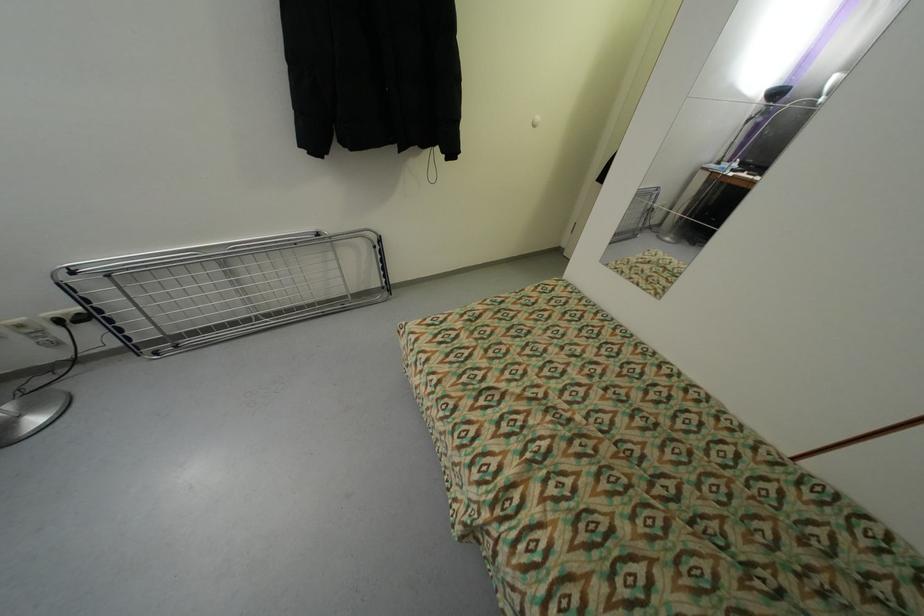
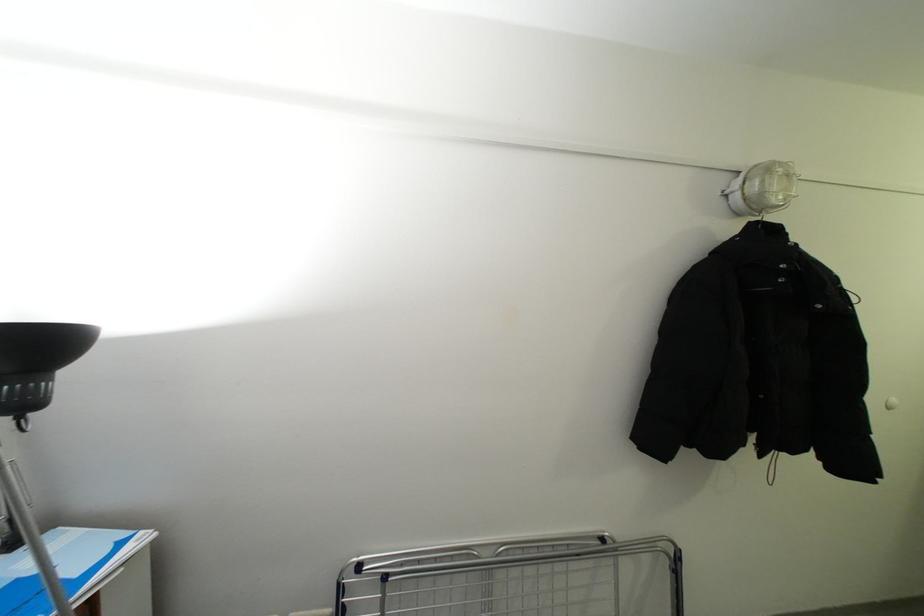
The point at (323, 236) is marked in the first image. Where is the corresponding point in the second image?

(609, 541)